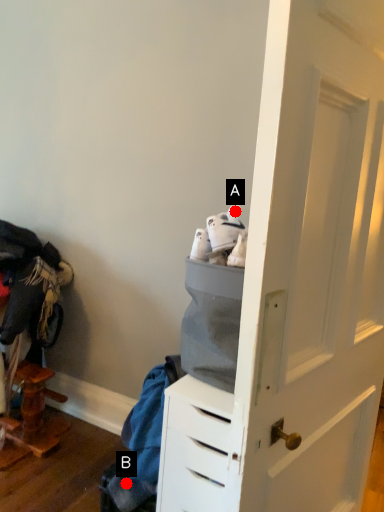
Question: Two points are circled on the image, labeled by A and B beside each circle. Which point is further to the camera?

Choices:
 (A) A is further
 (B) B is further

Answer: (B)